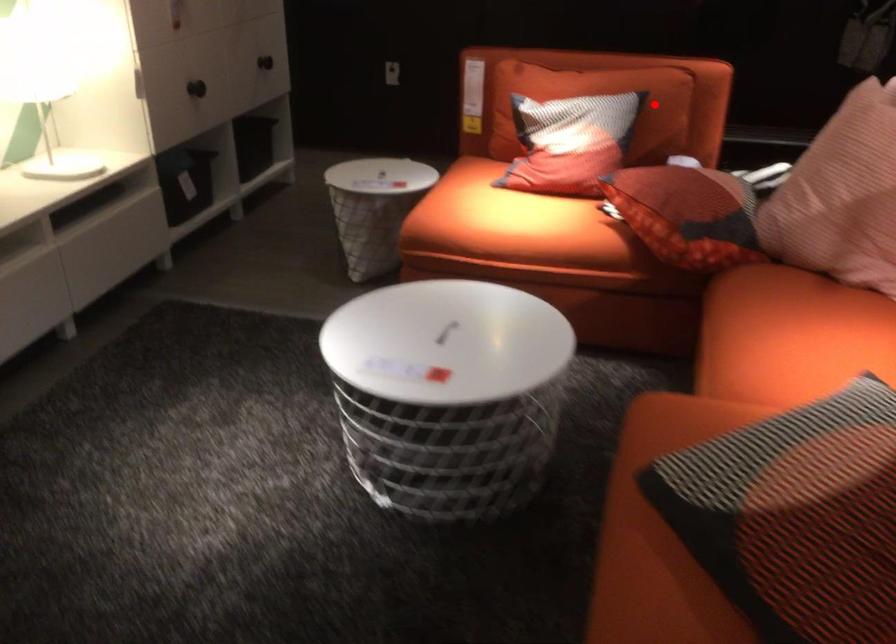
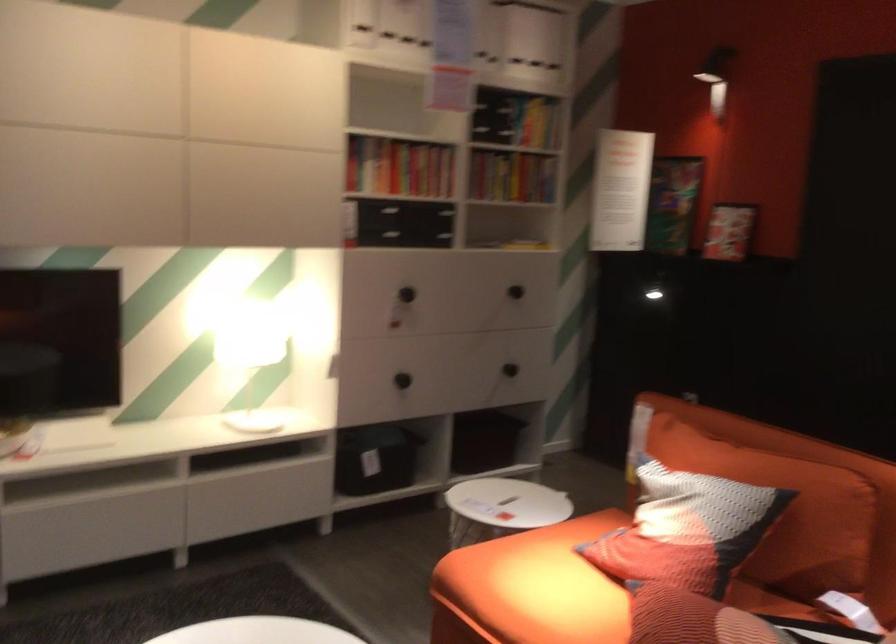
Question: A red point is marked in image1. In image2, is the corresponding 3D point closer to the camera or farther? Reply with the corresponding letter.

Choices:
 (A) The corresponding 3D point is closer.
 (B) The corresponding 3D point is farther.

Answer: (A)